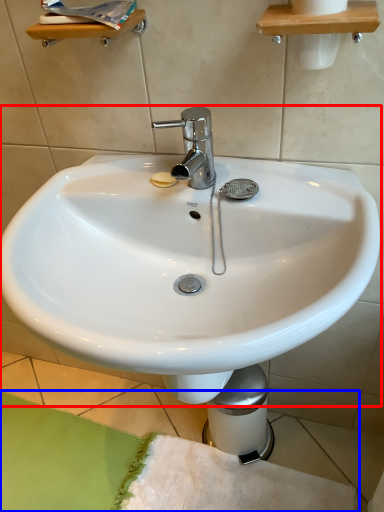
Question: Which point is further to the camera, sink (highlighted by a red box) or bath mat (highlighted by a blue box)?

Choices:
 (A) sink
 (B) bath mat

Answer: (B)